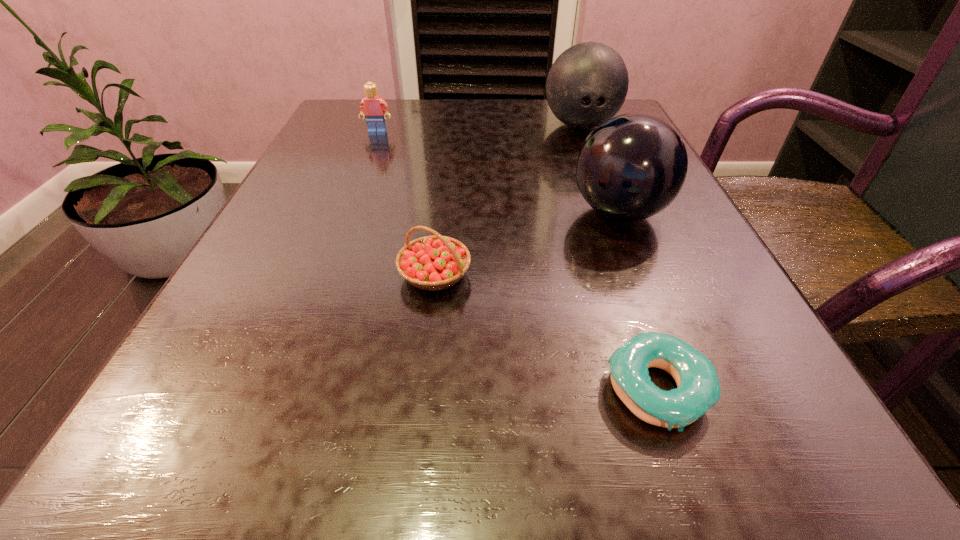
Where is `object located in the far left corner section of the desktop`? The image size is (960, 540). object located in the far left corner section of the desktop is located at coordinates (372, 107).

At what (x,y) coordinates should I click in order to perform the action: click on object that is positioned at the far right corner. Please return your answer as a coordinate pair (x, y). The width and height of the screenshot is (960, 540). Looking at the image, I should click on (587, 84).

Locate an element on the screen. This screenshot has width=960, height=540. object present at the near right corner is located at coordinates (698, 389).

At what (x,y) coordinates should I click in order to perform the action: click on free location at the far edge. Please return your answer as a coordinate pair (x, y). Looking at the image, I should click on [x=431, y=110].

Locate an element on the screen. vacant area at the near edge of the desktop is located at coordinates (508, 499).

The height and width of the screenshot is (540, 960). I want to click on free space at the left edge of the desktop, so click(379, 146).

At what (x,y) coordinates should I click in order to perform the action: click on vacant region at the right edge of the desktop. Please return your answer as a coordinate pair (x, y). The image size is (960, 540). Looking at the image, I should click on (619, 262).

Find the location of a particular element. vacant space at the near left corner of the desktop is located at coordinates (147, 460).

Image resolution: width=960 pixels, height=540 pixels. Identify the location of free space at the near right corner of the desktop. (733, 430).

Where is `free spot between the nearer bowling ball and the shortest object`? free spot between the nearer bowling ball and the shortest object is located at coordinates (638, 301).